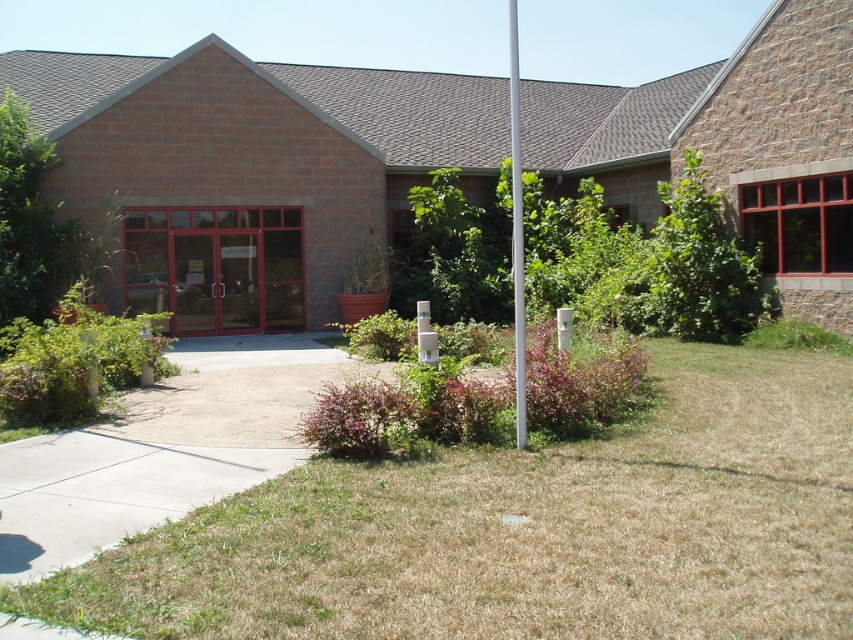
You are a gardener who needs to decide where to place a new flower bed. You see the brown grass at lower center and the white metallic pole at center. Which area has more space for planting?

The white metallic pole at center has more space for planting because the brown grass at lower center is smaller than it.